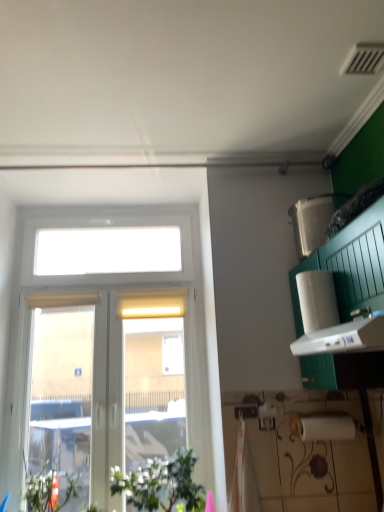
Question: Is green leafy plant at lower left in front of or behind white matte paper towel at right in the image?

Choices:
 (A) behind
 (B) front

Answer: (A)

Question: Considering the positions of point tap(150, 510) and point tap(332, 290), is point tap(150, 510) closer or farther from the camera than point tap(332, 290)?

Choices:
 (A) farther
 (B) closer

Answer: (A)

Question: Estimate the real-world distances between objects in this image. Which object is closer to the white plastic window at left?

Choices:
 (A) green leafy plant at lower left
 (B) white matte paper towel at right

Answer: (A)

Question: Considering the real-world distances, which object is closest to the white matte paper towel at right?

Choices:
 (A) green leafy plant at lower left
 (B) white plastic window at left

Answer: (A)